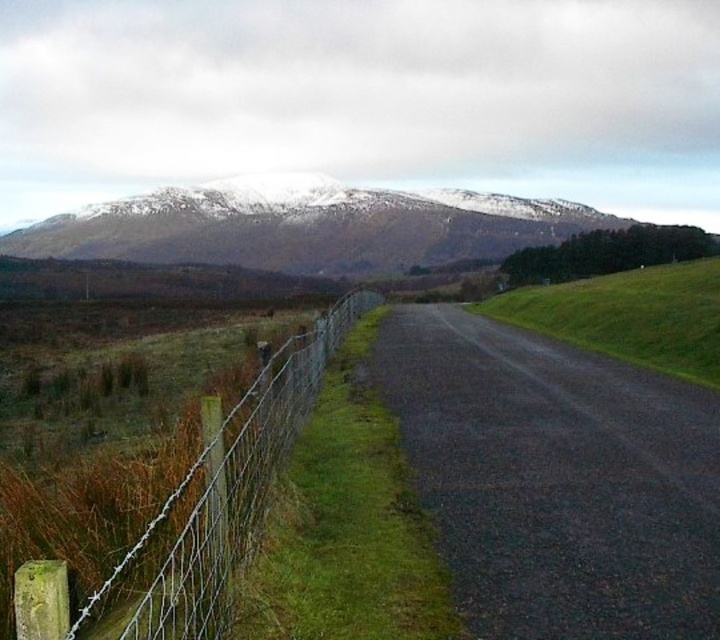
Looking at this image, can you confirm if snow-covered mountain at upper center is taller than wire mesh fence at left?

Yes, snow-covered mountain at upper center is taller than wire mesh fence at left.

Does snow-covered mountain at upper center come in front of wire mesh fence at left?

No, snow-covered mountain at upper center is further to the viewer.

Does point (445, 196) come farther from viewer compared to point (171, 611)?

Yes.

This screenshot has width=720, height=640. I want to click on snow-covered mountain at upper center, so click(x=306, y=227).